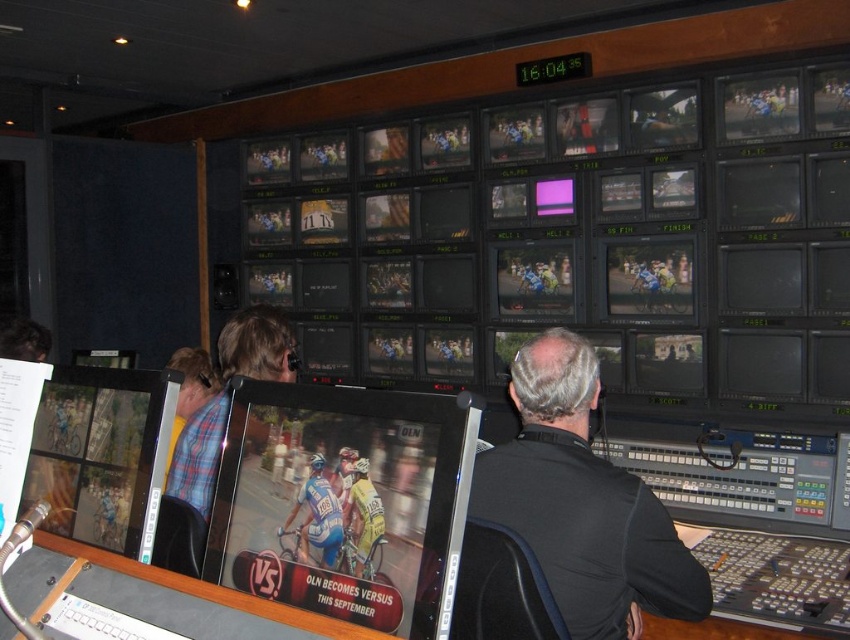
Can you confirm if shiny plastic monitor at center is wider than black matte monitor at center?

Correct, the width of shiny plastic monitor at center exceeds that of black matte monitor at center.

What do you see at coordinates (344, 500) in the screenshot? This screenshot has width=850, height=640. I see `shiny plastic monitor at center` at bounding box center [344, 500].

Locate an element on the screen. This screenshot has width=850, height=640. shiny plastic monitor at center is located at coordinates (344, 500).

Does black matte monitor at center appear over yellow jersey at center?

Yes.

Is black matte monitor at center behind yellow jersey at center?

That is True.

The height and width of the screenshot is (640, 850). What are the coordinates of `black matte monitor at center` in the screenshot? It's located at (761, 280).

Locate an element on the screen. This screenshot has width=850, height=640. black matte monitor at center is located at coordinates (761, 280).

Who is higher up, shiny plastic monitor at center or matte plastic computer screen at center?

matte plastic computer screen at center is above.

Is shiny plastic monitor at center below matte plastic computer screen at center?

Yes.

Who is more distant from viewer, (x=304, y=602) or (x=91, y=483)?

The point (x=91, y=483) is more distant.

The height and width of the screenshot is (640, 850). Find the location of `shiny plastic monitor at center`. shiny plastic monitor at center is located at coordinates [x=344, y=500].